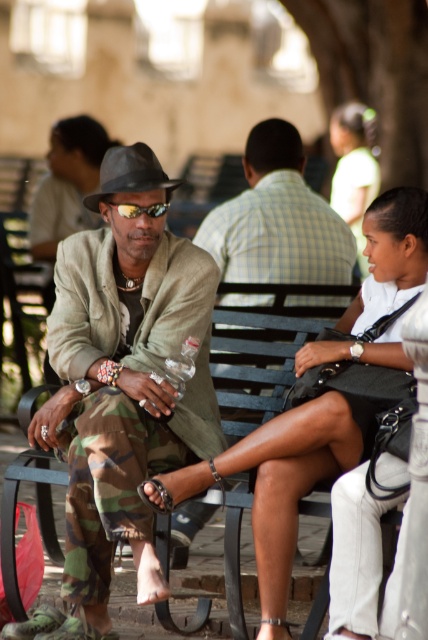
Looking at this image, you are a delivery person who needs to place a small package between the matte black bag at center and the yellow reflective lenses at center. Can you fit it there?

The matte black bag at center might be wider than yellow reflective lenses at center, so there might be enough space between them to fit the small package.

You are a photographer setting up a tripod to capture the scene. You need to ensure that both the camouflage pants at center and the matte black bag at center are visible in the shot. Which object should you position closer to the bottom of the frame to include both in the composition?

The matte black bag at center should be positioned closer to the bottom of the frame because the camouflage pants at center is located above it, so placing the bag lower ensures both are visible.